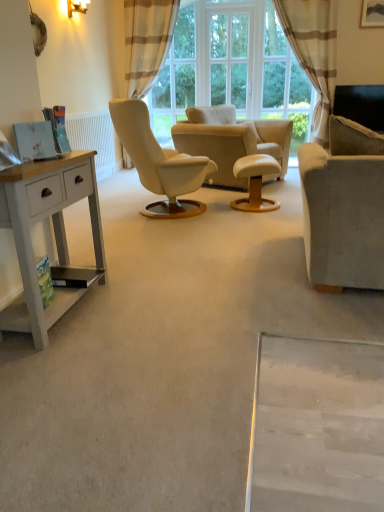
Find the location of `space that is in front of white painted wood desk at left`. space that is in front of white painted wood desk at left is located at coordinates (64, 369).